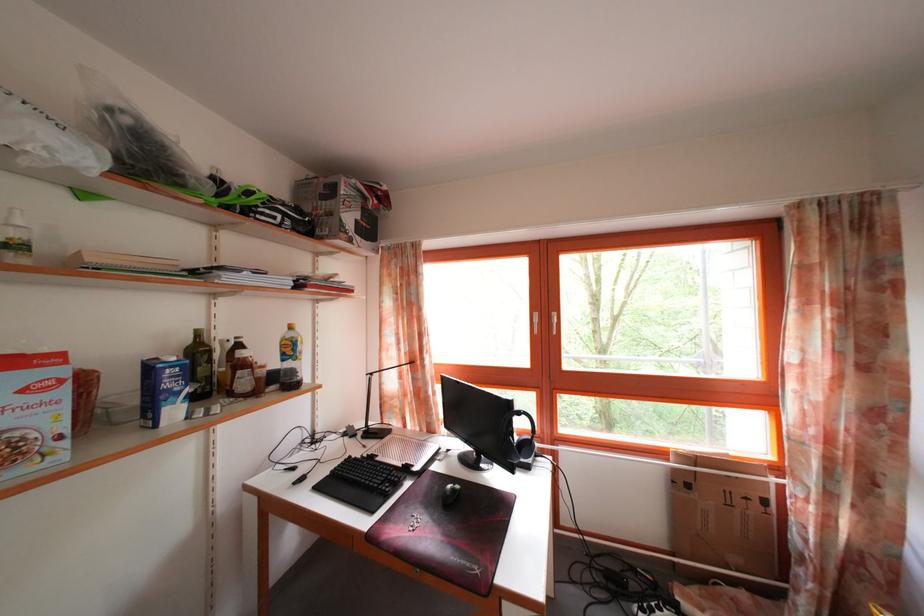
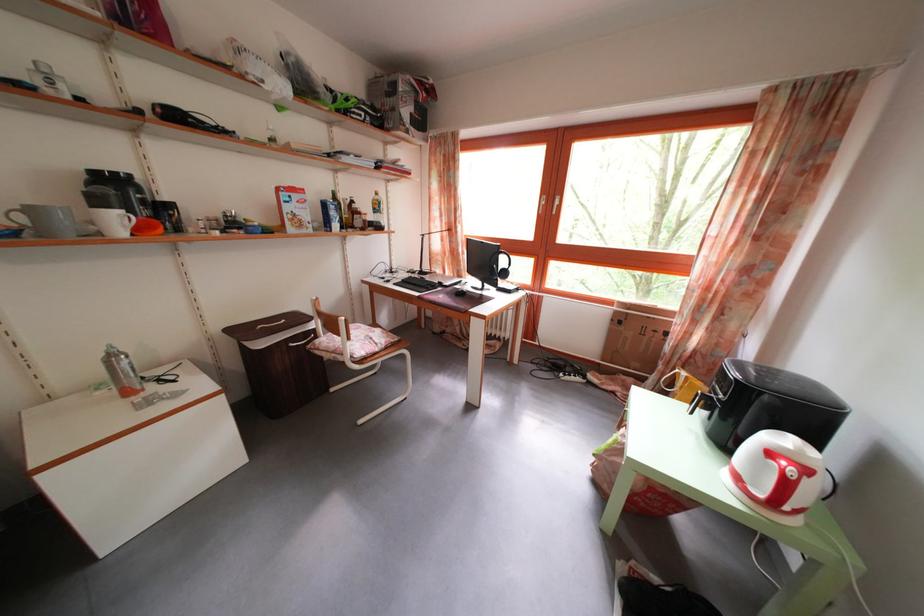
In the second image, find the point that corresponds to point (684, 477) in the first image.

(623, 320)